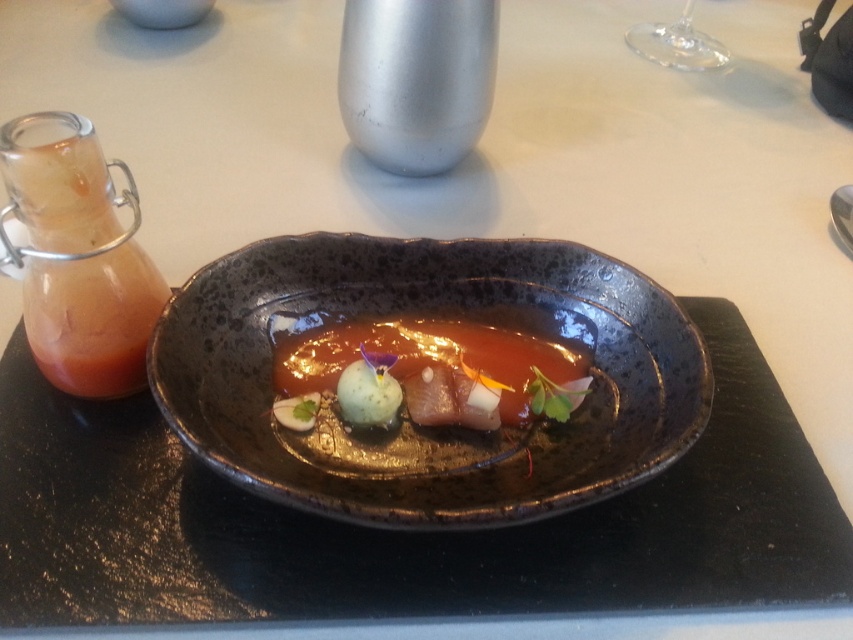
Question: Does speckled ceramic platter at center have a larger size compared to translucent glass bottle at left?

Choices:
 (A) no
 (B) yes

Answer: (B)

Question: Which point is farther to the camera?

Choices:
 (A) glossy ceramic plate at center
 (B) translucent glass bottle at left
 (C) speckled ceramic platter at center

Answer: (A)

Question: Can you confirm if speckled ceramic platter at center is positioned above glossy ceramic plate at center?

Choices:
 (A) yes
 (B) no

Answer: (B)

Question: Among these points, which one is nearest to the camera?

Choices:
 (A) (608, 451)
 (B) (454, 440)
 (C) (57, 284)

Answer: (C)

Question: Which point is farther to the camera?

Choices:
 (A) glossy ceramic plate at center
 (B) translucent glass bottle at left
 (C) speckled ceramic platter at center

Answer: (A)

Question: Is translucent glass bottle at left further to the viewer compared to glossy ceramic plate at center?

Choices:
 (A) yes
 (B) no

Answer: (B)